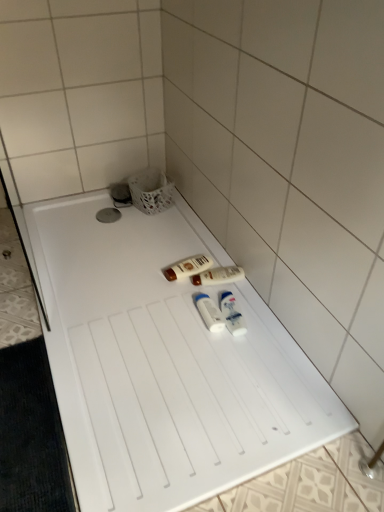
This screenshot has height=512, width=384. What are the coordinates of `vacant area on the back side of white plastic bottles at center, the 1th toiletry from the front` in the screenshot? It's located at click(230, 289).